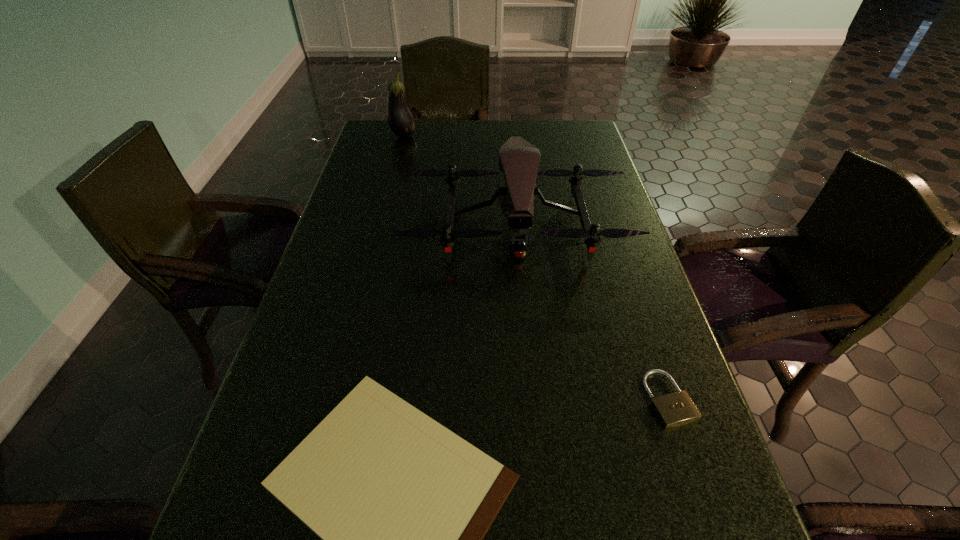
Locate which object ranks in proximity to the third tallest object. Please provide its 2D coordinates. Your answer should be formatted as a tuple, i.e. [(x, y)], where the tuple contains the x and y coordinates of a point satisfying the conditions above.

[(402, 504)]

The width and height of the screenshot is (960, 540). In order to click on vacant space that satisfies the following two spatial constraints: 1. on the front-facing side of the second farthest object; 2. on the right side of the padlock in this screenshot , I will do `click(531, 399)`.

I want to click on vacant region that satisfies the following two spatial constraints: 1. on the front-facing side of the third nearest object; 2. on the left side of the second shortest object, so click(x=531, y=399).

I want to click on free spot that satisfies the following two spatial constraints: 1. on the front-facing side of the third nearest object; 2. on the left side of the third tallest object, so click(531, 399).

Image resolution: width=960 pixels, height=540 pixels. Identify the location of free space that satisfies the following two spatial constraints: 1. on the front-facing side of the third nearest object; 2. on the left side of the third tallest object. (531, 399).